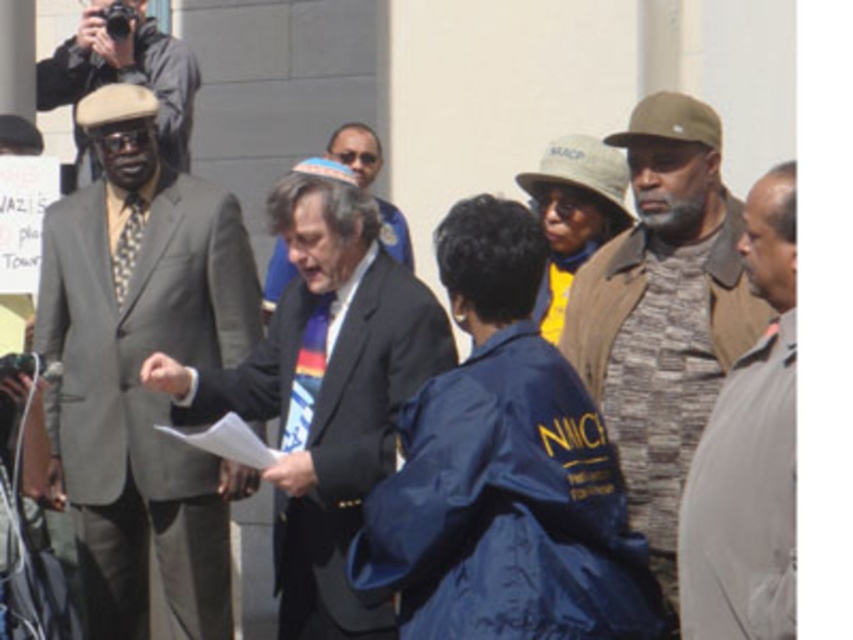
You are a photographer at the event and want to capture a photo that includes both the dark suit at center and the camouflage fabric hat at center. Based on their positions, which object should be placed to the left in the frame?

The dark suit at center is positioned on the left side of camouflage fabric hat at center, so in the frame, the dark suit at center should be placed to the left of the camouflage fabric hat at center.

You are a photographer trying to capture a clear photo of the dark suit at center and camouflage fabric hat at center. Since you want both subjects to appear equally sized in the photo, which object should you move closer to and which should you move away from?

Since the dark suit at center is wider than the camouflage fabric hat at center, to make them appear equally sized in the photo, you should move closer to the camouflage fabric hat at center and move away from the dark suit at center.

In the scene shown: You are organizing a community event and need to decide which item to place on a small table that can only hold one object. Based on the image, which object would you choose between the gray camouflage jacket at right and the rainbow fabric tie at center, and why?

The gray camouflage jacket at right is larger in size than the rainbow fabric tie at center, so you should choose the rainbow fabric tie at center because it will fit better on the small table.